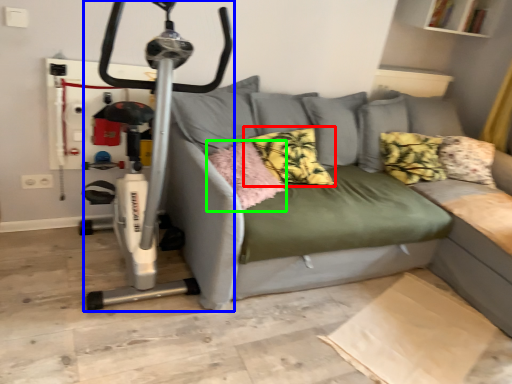
Question: Considering the real-world distances, which object is farthest from pillow (highlighted by a red box)? sport equipment (highlighted by a blue box) or pillow (highlighted by a green box)?

Choices:
 (A) sport equipment
 (B) pillow

Answer: (A)